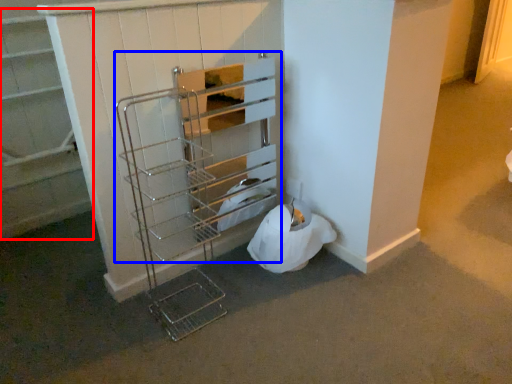
Question: Which point is closer to the camera, shelf (highlighted by a red box) or shelf (highlighted by a blue box)?

Choices:
 (A) shelf
 (B) shelf

Answer: (B)